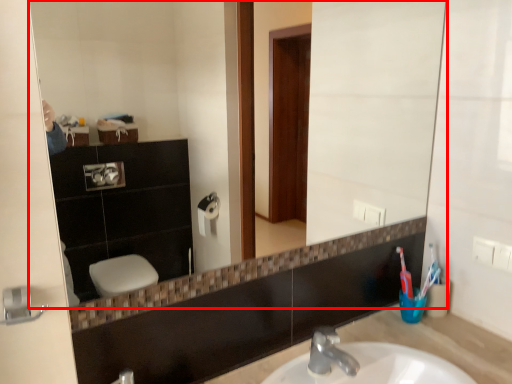
Question: From the image, what is the correct spatial relationship of mirror (annotated by the red box) in relation to counter top?

Choices:
 (A) left
 (B) right

Answer: (A)